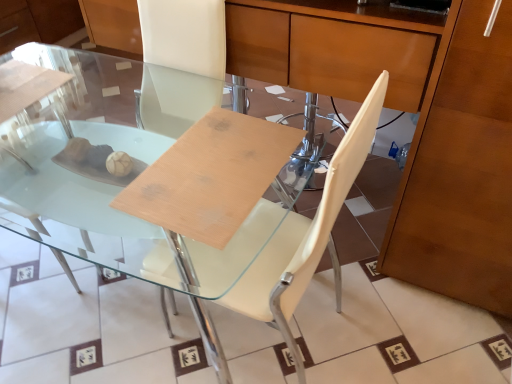
Identify the location of vacant region to the right of white leather chair at center. The image size is (512, 384). (375, 326).